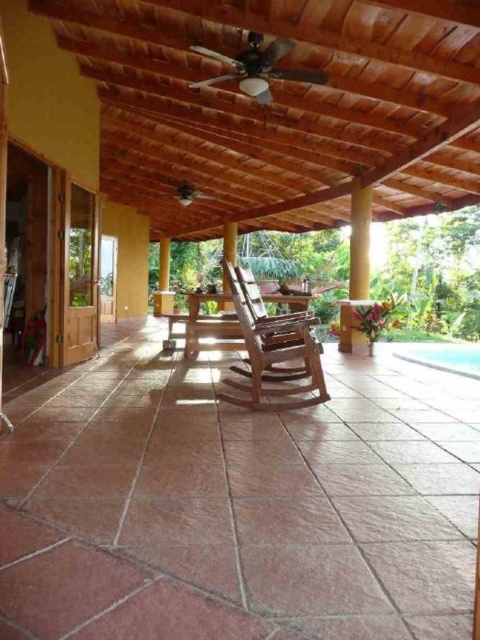
The width and height of the screenshot is (480, 640). What do you see at coordinates (272, 349) in the screenshot?
I see `wooden rocking chair at center` at bounding box center [272, 349].

Who is positioned more to the right, wooden rocking chair at center or clear blue water at lower right?

clear blue water at lower right is more to the right.

Describe the element at coordinates (272, 349) in the screenshot. The width and height of the screenshot is (480, 640). I see `wooden rocking chair at center` at that location.

Identify the location of wooden rocking chair at center. (272, 349).